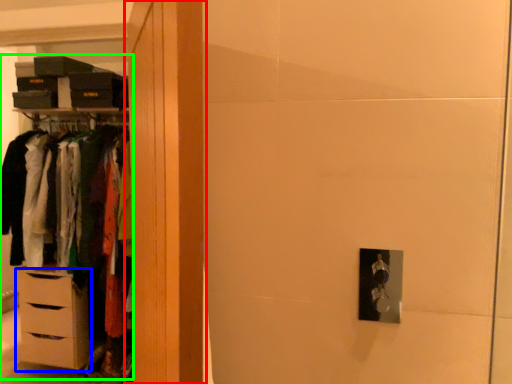
Question: Which object is positioned farthest from armoire (highlighted by a red box)? Select from chest of drawers (highlighted by a blue box) and dresser (highlighted by a green box).

Choices:
 (A) chest of drawers
 (B) dresser

Answer: (B)